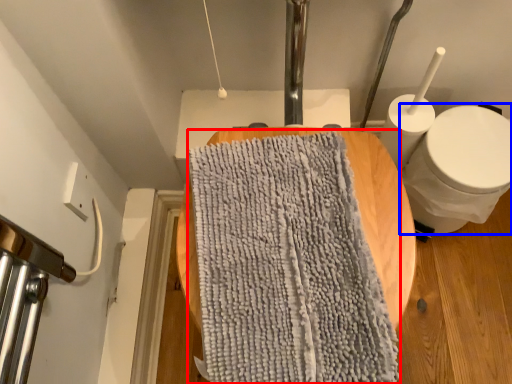
Question: Which of the following is the farthest to the observer, bath towel (highlighted by a red box) or toilet (highlighted by a blue box)?

Choices:
 (A) bath towel
 (B) toilet

Answer: (B)